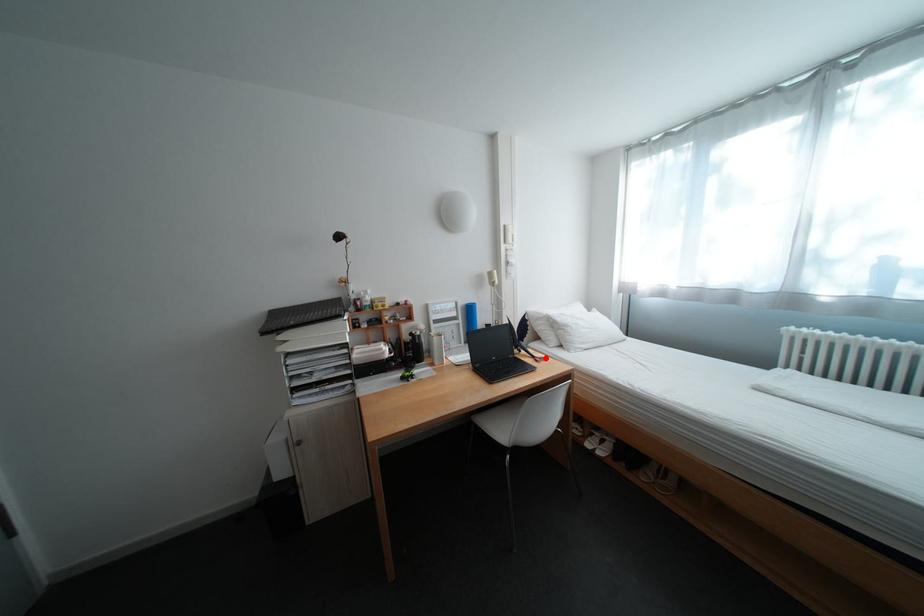
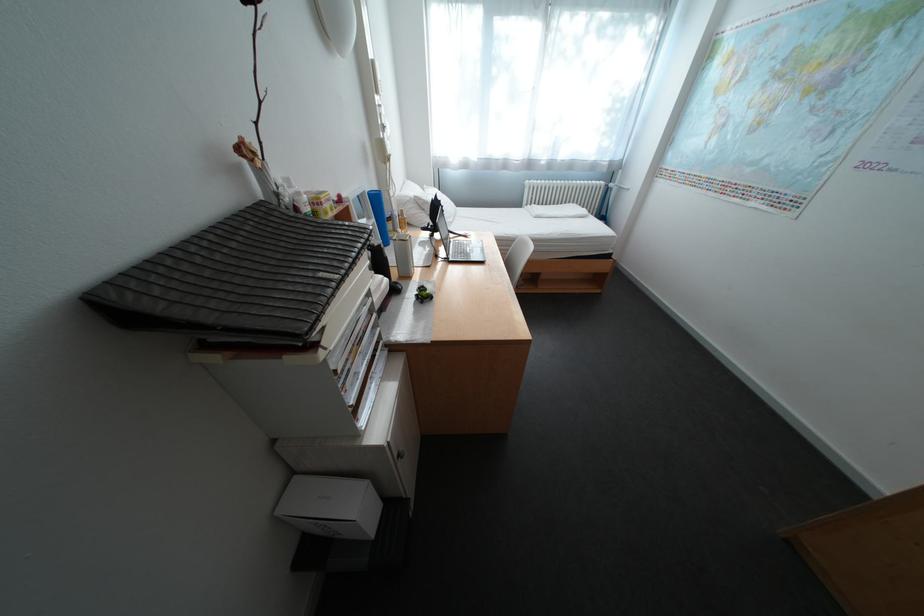
In the second image, find the point that corresponds to the highlighted location in the first image.

(472, 236)